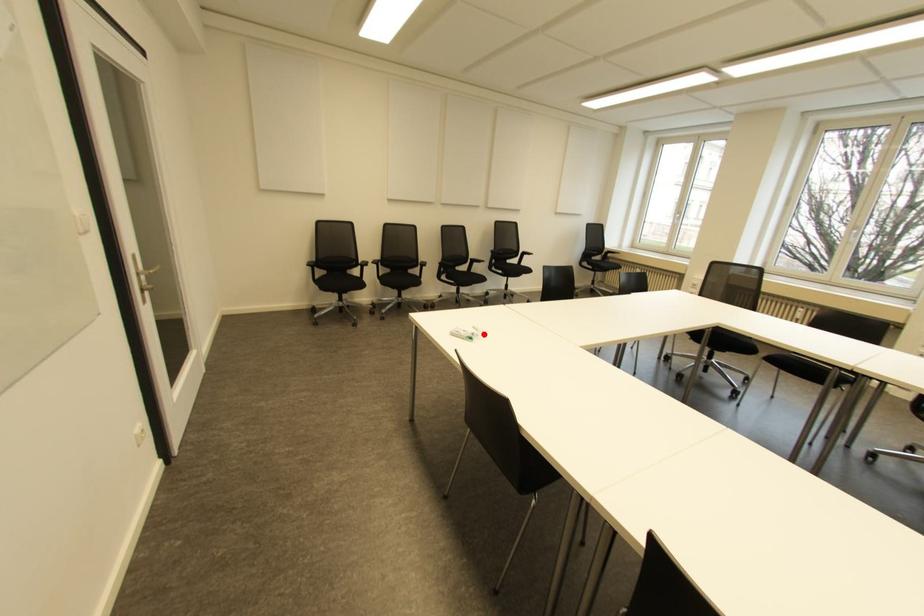
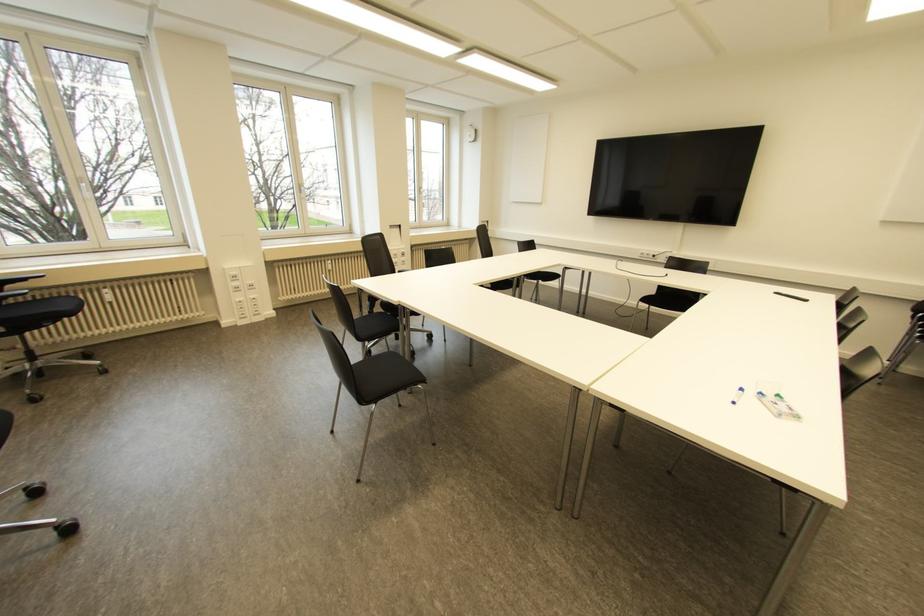
Find the pixel in the second image that matches the highlighted location in the first image.

(739, 390)